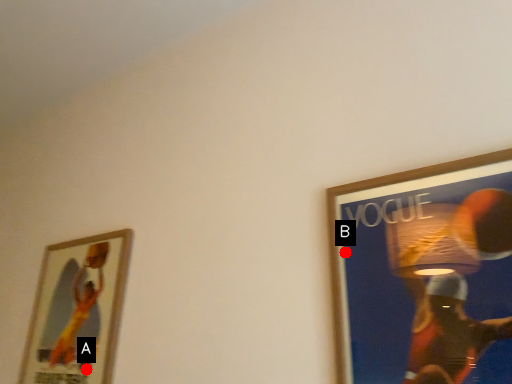
Question: Two points are circled on the image, labeled by A and B beside each circle. Which point is closer to the camera?

Choices:
 (A) A is closer
 (B) B is closer

Answer: (B)